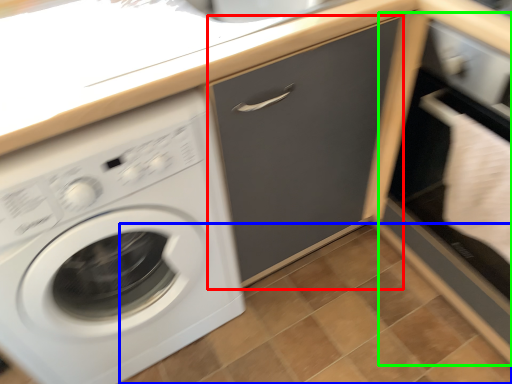
Question: Considering the real-world distances, which object is farthest from drawer (highlighted by a red box)? tile (highlighted by a blue box) or file cabinet (highlighted by a green box)?

Choices:
 (A) tile
 (B) file cabinet

Answer: (A)